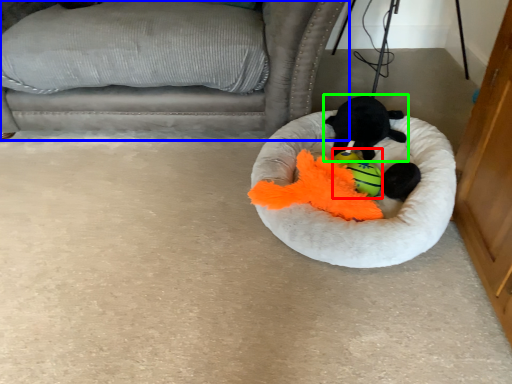
Question: Based on their relative distances, which object is farther from toy (highlighted by a red box)? Choose from furniture (highlighted by a blue box) and toy (highlighted by a green box).

Choices:
 (A) furniture
 (B) toy

Answer: (A)